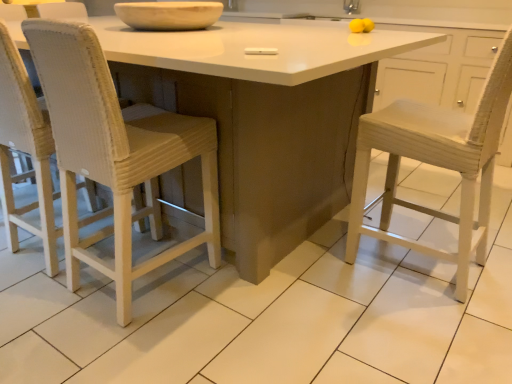
Question: Is white matte table at center far from silver metallic faucet at upper right?

Choices:
 (A) yes
 (B) no

Answer: (A)

Question: Considering the relative positions of white matte table at center and silver metallic faucet at upper right in the image provided, is white matte table at center to the right of silver metallic faucet at upper right from the viewer's perspective?

Choices:
 (A) yes
 (B) no

Answer: (B)

Question: Does white matte table at center come behind silver metallic faucet at upper right?

Choices:
 (A) no
 (B) yes

Answer: (A)

Question: Can you confirm if white matte table at center is wider than silver metallic faucet at upper right?

Choices:
 (A) yes
 (B) no

Answer: (A)

Question: Is white matte table at center to the left of silver metallic faucet at upper right from the viewer's perspective?

Choices:
 (A) no
 (B) yes

Answer: (B)

Question: Is silver metallic faucet at upper right taller or shorter than matte white bowl at upper center?

Choices:
 (A) short
 (B) tall

Answer: (A)

Question: From a real-world perspective, is silver metallic faucet at upper right above or below matte white bowl at upper center?

Choices:
 (A) below
 (B) above

Answer: (B)

Question: From the image's perspective, is silver metallic faucet at upper right positioned above or below matte white bowl at upper center?

Choices:
 (A) below
 (B) above

Answer: (B)

Question: Considering the relative positions of silver metallic faucet at upper right and matte white bowl at upper center in the image provided, is silver metallic faucet at upper right to the left or to the right of matte white bowl at upper center?

Choices:
 (A) right
 (B) left

Answer: (A)

Question: Is matte white bowl at upper center inside the boundaries of white matte table at center, or outside?

Choices:
 (A) outside
 (B) inside

Answer: (A)

Question: From the image's perspective, relative to white matte table at center, is matte white bowl at upper center above or below?

Choices:
 (A) above
 (B) below

Answer: (A)

Question: From their relative heights in the image, would you say matte white bowl at upper center is taller or shorter than white matte table at center?

Choices:
 (A) short
 (B) tall

Answer: (A)

Question: From a real-world perspective, is matte white bowl at upper center positioned above or below white matte table at center?

Choices:
 (A) above
 (B) below

Answer: (A)

Question: Is white matte table at center in front of or behind silver metallic faucet at upper right in the image?

Choices:
 (A) front
 (B) behind

Answer: (A)

Question: From a real-world perspective, is white matte table at center physically located above or below silver metallic faucet at upper right?

Choices:
 (A) below
 (B) above

Answer: (A)